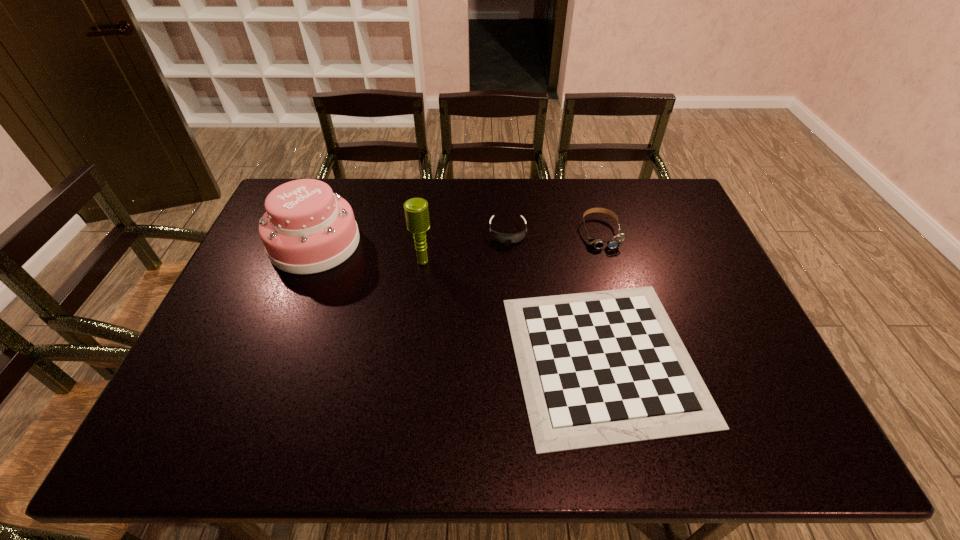
The height and width of the screenshot is (540, 960). I want to click on object located at the near right corner, so click(x=600, y=368).

Identify the location of free location at the far edge of the desktop. (630, 200).

Image resolution: width=960 pixels, height=540 pixels. I want to click on free space at the near edge of the desktop, so click(x=524, y=438).

Where is `vacant area at the left edge of the desktop`? The image size is (960, 540). vacant area at the left edge of the desktop is located at coordinates (205, 400).

Where is `free space at the right edge of the desktop`? free space at the right edge of the desktop is located at coordinates (763, 375).

Image resolution: width=960 pixels, height=540 pixels. Identify the location of vacant area between the taller goggles and the second tallest object. (458, 238).

Where is `vacant area that lies between the microphone and the fourth shortest object`? The image size is (960, 540). vacant area that lies between the microphone and the fourth shortest object is located at coordinates (369, 252).

You are a GUI agent. You are given a task and a screenshot of the screen. Output one action in this format:
    pyautogui.click(x=<x>, y=<y>)
    Task: Click on the free space between the cake and the fourth tallest object
    
    Given the screenshot: What is the action you would take?
    pyautogui.click(x=411, y=238)

Locate an element on the screen. vacant space that is in between the right goggles and the second shortest object is located at coordinates (554, 232).

This screenshot has height=540, width=960. Find the location of `unoccupied position between the third tallest object and the cake`. unoccupied position between the third tallest object and the cake is located at coordinates (458, 238).